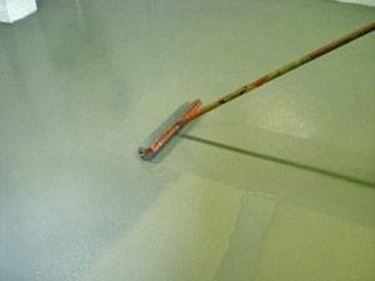
Image resolution: width=375 pixels, height=281 pixels. Find the location of `handle shadow`. handle shadow is located at coordinates (304, 169).